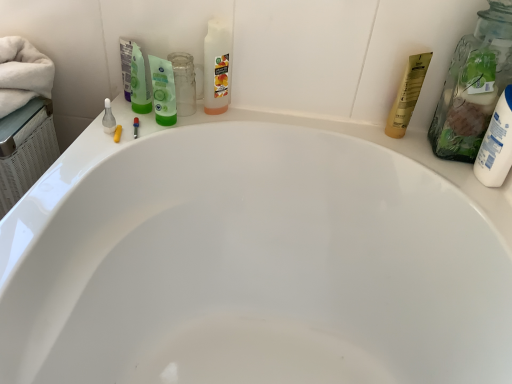
Question: Is yellow matte tube at upper right, placed as the first toiletry when sorted from left to right, situated inside translucent glass jar at upper right or outside?

Choices:
 (A) outside
 (B) inside

Answer: (A)

Question: Considering the positions of yellow matte tube at upper right, the second toiletry from the right, and translucent glass jar at upper right in the image, is yellow matte tube at upper right, the second toiletry from the right, taller or shorter than translucent glass jar at upper right?

Choices:
 (A) tall
 (B) short

Answer: (B)

Question: Estimate the real-world distances between objects in this image. Which object is closer to the translucent glass jar at upper right?

Choices:
 (A) green matte mouthwash at upper center
 (B) white matte lotion at right, marked as the first toiletry in a right-to-left arrangement
 (C) yellow matte tube at upper right, the second toiletry from the right

Answer: (B)

Question: Which object is positioned closest to the green matte mouthwash at upper center?

Choices:
 (A) translucent glass jar at upper right
 (B) white matte lotion at right, the 2th toiletry in the left-to-right sequence
 (C) yellow matte tube at upper right, the first toiletry when ordered from back to front

Answer: (C)